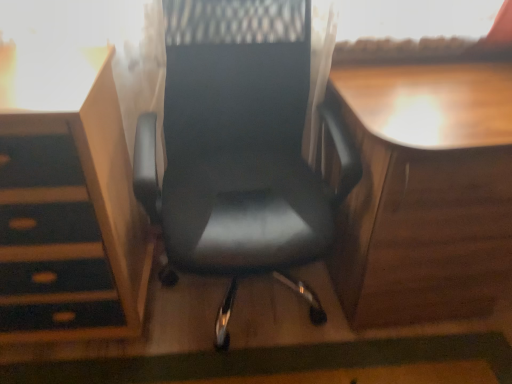
Question: Does wooden desk at right have a greater height compared to matte wood vanity at left?

Choices:
 (A) yes
 (B) no

Answer: (B)

Question: From a real-world perspective, is wooden desk at right physically above matte wood vanity at left?

Choices:
 (A) yes
 (B) no

Answer: (B)

Question: Does wooden desk at right have a lesser height compared to matte wood vanity at left?

Choices:
 (A) yes
 (B) no

Answer: (A)

Question: Is wooden desk at right not within matte wood vanity at left?

Choices:
 (A) yes
 (B) no

Answer: (A)

Question: From a real-world perspective, is wooden desk at right physically below matte wood vanity at left?

Choices:
 (A) no
 (B) yes

Answer: (B)

Question: In terms of height, does black leather chair at center look taller or shorter compared to matte wood vanity at left?

Choices:
 (A) tall
 (B) short

Answer: (A)

Question: From the image's perspective, is black leather chair at center above or below matte wood vanity at left?

Choices:
 (A) below
 (B) above

Answer: (B)

Question: Relative to matte wood vanity at left, is black leather chair at center in front or behind?

Choices:
 (A) behind
 (B) front

Answer: (B)

Question: Considering the positions of point (214, 89) and point (37, 104), is point (214, 89) closer or farther from the camera than point (37, 104)?

Choices:
 (A) farther
 (B) closer

Answer: (A)

Question: From their relative heights in the image, would you say wooden desk at right is taller or shorter than matte wood vanity at left?

Choices:
 (A) short
 (B) tall

Answer: (A)

Question: Looking at their shapes, would you say wooden desk at right is wider or thinner than matte wood vanity at left?

Choices:
 (A) wide
 (B) thin

Answer: (A)

Question: Would you say wooden desk at right is to the left or to the right of matte wood vanity at left in the picture?

Choices:
 (A) right
 (B) left

Answer: (A)

Question: Is wooden desk at right inside the boundaries of matte wood vanity at left, or outside?

Choices:
 (A) outside
 (B) inside

Answer: (A)

Question: Would you say matte wood vanity at left is to the left or to the right of wooden desk at right in the picture?

Choices:
 (A) left
 (B) right

Answer: (A)

Question: Based on their sizes in the image, would you say matte wood vanity at left is bigger or smaller than wooden desk at right?

Choices:
 (A) big
 (B) small

Answer: (B)